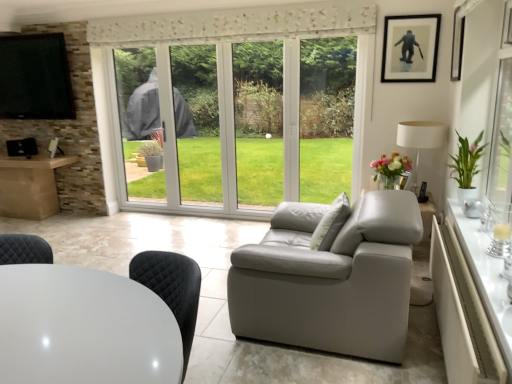
Question: Is white glossy table at right, the first table from the right, far from black matte picture frame at upper right, which appears as the second picture frame when viewed from the front?

Choices:
 (A) yes
 (B) no

Answer: (A)

Question: Is black matte picture frame at upper right, which appears as the second picture frame when viewed from the front, at the back of white glossy table at right, the first table from the right?

Choices:
 (A) no
 (B) yes

Answer: (A)

Question: Can you confirm if white glossy table at right, the second table from the left, is taller than black matte picture frame at upper right, which appears as the second picture frame when viewed from the front?

Choices:
 (A) no
 (B) yes

Answer: (A)

Question: From a real-world perspective, is white glossy table at right, the second table from the left, physically above black matte picture frame at upper right, which appears as the second picture frame when viewed from the front?

Choices:
 (A) no
 (B) yes

Answer: (A)

Question: From the image's perspective, is white glossy table at right, the first table from the right, over black matte picture frame at upper right, positioned as the 1th picture frame in back-to-front order?

Choices:
 (A) yes
 (B) no

Answer: (B)

Question: Does point (417, 172) appear closer or farther from the camera than point (455, 43)?

Choices:
 (A) farther
 (B) closer

Answer: (A)

Question: From a real-world perspective, relative to black glossy picture frame at upper right, which appears as the 1th picture frame when viewed from the front, is white fabric lampshade at right vertically above or below?

Choices:
 (A) above
 (B) below

Answer: (B)

Question: Is white fabric lampshade at right taller or shorter than black glossy picture frame at upper right, the 2th picture frame from the back?

Choices:
 (A) tall
 (B) short

Answer: (A)

Question: Is white fabric lampshade at right inside the boundaries of black glossy picture frame at upper right, the 2th picture frame from the back, or outside?

Choices:
 (A) outside
 (B) inside

Answer: (A)

Question: Is white textured pillow at center taller or shorter than black matte picture frame at upper right, which appears as the second picture frame when viewed from the front?

Choices:
 (A) short
 (B) tall

Answer: (B)

Question: Is white textured pillow at center bigger or smaller than black matte picture frame at upper right, which appears as the second picture frame when viewed from the front?

Choices:
 (A) big
 (B) small

Answer: (A)

Question: Looking at their shapes, would you say white textured pillow at center is wider or thinner than black matte picture frame at upper right, positioned as the 1th picture frame in back-to-front order?

Choices:
 (A) wide
 (B) thin

Answer: (A)

Question: From a real-world perspective, is white textured pillow at center physically located above or below black matte picture frame at upper right, positioned as the 1th picture frame in back-to-front order?

Choices:
 (A) below
 (B) above

Answer: (A)

Question: In the image, is white glossy table at lower left, which is counted as the second table, starting from the right, positioned in front of or behind white textured pillow at center?

Choices:
 (A) front
 (B) behind

Answer: (A)

Question: Do you think white glossy table at lower left, the 1th table viewed from the left, is within white textured pillow at center, or outside of it?

Choices:
 (A) inside
 (B) outside

Answer: (B)